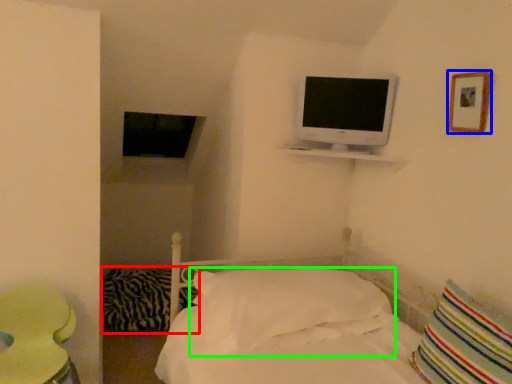
Question: Which object is positioned closest to pillow (highlighted by a red box)? Select from picture frame (highlighted by a blue box) and pillow (highlighted by a green box).

Choices:
 (A) picture frame
 (B) pillow

Answer: (B)